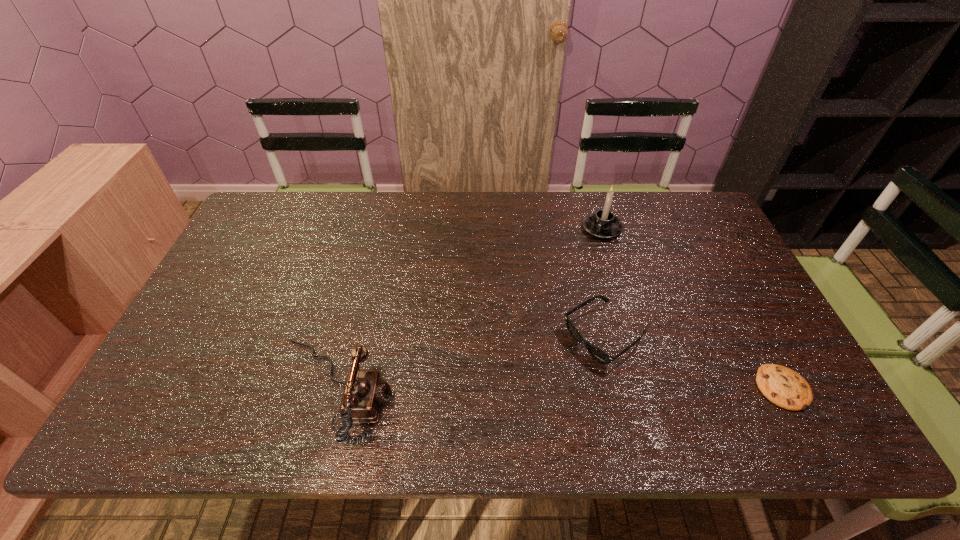
This screenshot has width=960, height=540. I want to click on vacant space situated 0.100m on the front-facing side of the second shortest object, so click(x=544, y=377).

The height and width of the screenshot is (540, 960). Identify the location of vacant space located on the front-facing side of the second shortest object. (525, 390).

You are a GUI agent. You are given a task and a screenshot of the screen. Output one action in this format:
    pyautogui.click(x=<x>, y=<y>)
    Task: Click on the vacant space located 0.250m with a handle on the side of the farthest object
    This screenshot has width=960, height=540.
    Given the screenshot: What is the action you would take?
    pyautogui.click(x=567, y=292)

Where is `blank area located 0.190m with a handle on the side of the farthest object`? blank area located 0.190m with a handle on the side of the farthest object is located at coordinates (575, 278).

Where is `free space located 0.050m with a handle on the side of the farthest object`? free space located 0.050m with a handle on the side of the farthest object is located at coordinates [590, 249].

Identify the location of object that is at the far edge. The image size is (960, 540). (603, 224).

At what (x,y) coordinates should I click in order to perform the action: click on telephone that is positioned at the near edge. Please return your answer as a coordinate pair (x, y). Looking at the image, I should click on (365, 390).

Locate an element on the screen. This screenshot has height=540, width=960. cookie that is positioned at the near edge is located at coordinates point(782,386).

Find the location of a particular element. The width and height of the screenshot is (960, 540). sunglasses positioned at the near edge is located at coordinates (598, 354).

The image size is (960, 540). What are the coordinates of `object at the right edge` in the screenshot? It's located at (782, 386).